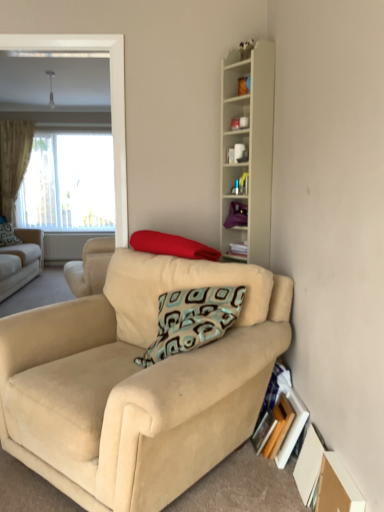
Question: Is teal plastic cup at upper center at the back of red fabric pillow at center, which ranks as the first pillow in bottom-to-top order?

Choices:
 (A) yes
 (B) no

Answer: (B)

Question: Can you confirm if red fabric pillow at center, the 2th pillow from the left, is smaller than teal plastic cup at upper center?

Choices:
 (A) yes
 (B) no

Answer: (B)

Question: Is red fabric pillow at center, the 2th pillow from the left, at the left side of teal plastic cup at upper center?

Choices:
 (A) yes
 (B) no

Answer: (A)

Question: Can you confirm if red fabric pillow at center, which is the 2th pillow in top-to-bottom order, is thinner than teal plastic cup at upper center?

Choices:
 (A) yes
 (B) no

Answer: (B)

Question: Is red fabric pillow at center, the 2th pillow from the left, touching teal plastic cup at upper center?

Choices:
 (A) no
 (B) yes

Answer: (A)

Question: Is red fabric pillow at center, the 2th pillow from the left, in front of teal plastic cup at upper center?

Choices:
 (A) yes
 (B) no

Answer: (A)

Question: Can you confirm if white matte mug at upper center, which ranks as the 2th cabinet in bottom-to-top order, is thinner than patterned fabric pillow at left, which appears as the second pillow when viewed from the front?

Choices:
 (A) no
 (B) yes

Answer: (B)

Question: Is white matte mug at upper center, the first cabinet from the top, not within patterned fabric pillow at left, which is the first pillow in top-to-bottom order?

Choices:
 (A) no
 (B) yes

Answer: (B)

Question: Would you say white matte mug at upper center, which ranks as the 2th cabinet in bottom-to-top order, is a long distance from patterned fabric pillow at left, which appears as the second pillow when viewed from the front?

Choices:
 (A) yes
 (B) no

Answer: (A)

Question: From the image's perspective, would you say white matte mug at upper center, which ranks as the 2th cabinet in bottom-to-top order, is positioned over patterned fabric pillow at left, which appears as the second pillow when viewed from the front?

Choices:
 (A) yes
 (B) no

Answer: (A)

Question: Does white matte mug at upper center, which ranks as the 2th cabinet in bottom-to-top order, touch patterned fabric pillow at left, which appears as the second pillow when viewed from the front?

Choices:
 (A) yes
 (B) no

Answer: (B)

Question: Considering the relative sizes of white matte mug at upper center, which ranks as the 2th cabinet in bottom-to-top order, and patterned fabric pillow at left, arranged as the first pillow when viewed from the back, in the image provided, is white matte mug at upper center, which ranks as the 2th cabinet in bottom-to-top order, smaller than patterned fabric pillow at left, arranged as the first pillow when viewed from the back,?

Choices:
 (A) yes
 (B) no

Answer: (A)

Question: Is brown cardboard box at lower right aimed at beige fabric couch at left, which ranks as the first studio couch in back-to-front order?

Choices:
 (A) yes
 (B) no

Answer: (B)